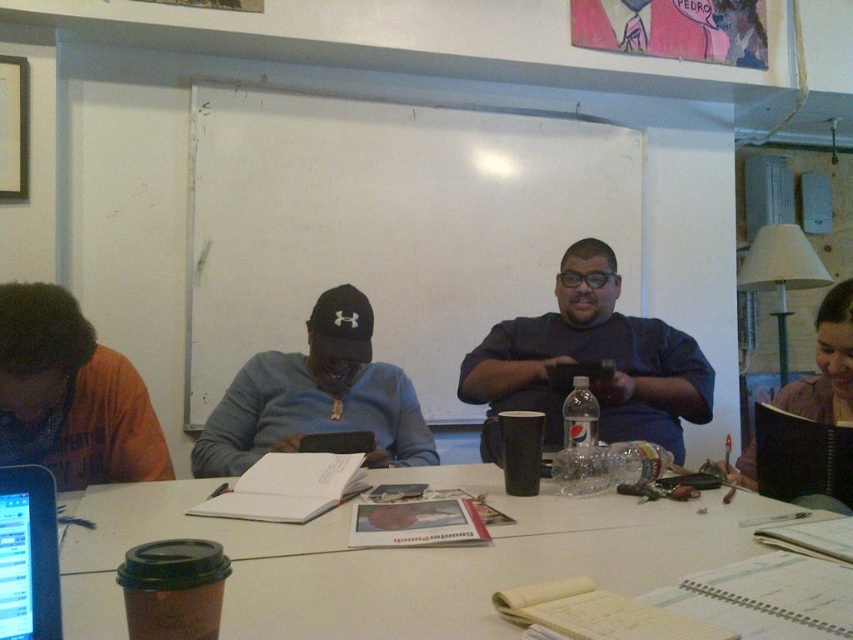
Question: Among these objects, which one is nearest to the camera?

Choices:
 (A) white matte whiteboard at center
 (B) black glossy laptop at lower left

Answer: (B)

Question: Which of the following is the closest to the observer?

Choices:
 (A) (265, 436)
 (B) (160, 435)
 (C) (724, 529)
 (D) (619, 276)

Answer: (C)

Question: Is dark blue shirt at center bigger than black glossy laptop at lower left?

Choices:
 (A) yes
 (B) no

Answer: (A)

Question: Does white matte whiteboard at center appear on the right side of black glossy laptop at lower left?

Choices:
 (A) no
 (B) yes

Answer: (B)

Question: Does orange cotton shirt at left appear on the right side of black glossy laptop at lower left?

Choices:
 (A) yes
 (B) no

Answer: (B)

Question: Which point appears farthest from the camera in this image?

Choices:
 (A) (305, 589)
 (B) (322, 300)
 (C) (595, 292)
 (D) (851, 406)

Answer: (C)